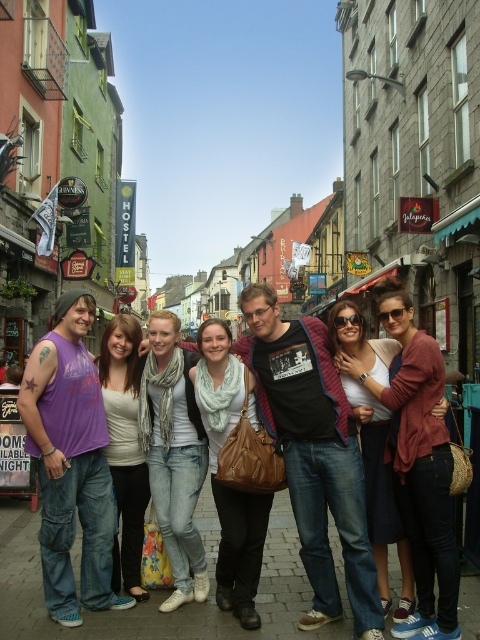
Who is shorter, light blue denim jeans at center or light blue scarf at center?

Standing shorter between the two is light blue scarf at center.

Between light blue denim jeans at center and light blue scarf at center, which one appears on the right side from the viewer's perspective?

light blue scarf at center is more to the right.

The image size is (480, 640). What are the coordinates of `light blue denim jeans at center` in the screenshot? It's located at pos(173,452).

Is denim skirt at center in front of light beige scarf at center?

Yes, denim skirt at center is closer to the viewer.

Can you confirm if denim skirt at center is positioned above light beige scarf at center?

Yes, denim skirt at center is above light beige scarf at center.

Find the location of a particular element. The image size is (480, 640). denim skirt at center is located at coordinates [381, 496].

This screenshot has width=480, height=640. I want to click on denim skirt at center, so click(381, 496).

Who is lower down, light blue denim jeans at center or light beige scarf at center?

Positioned lower is light beige scarf at center.

The width and height of the screenshot is (480, 640). What do you see at coordinates (173, 452) in the screenshot?
I see `light blue denim jeans at center` at bounding box center [173, 452].

You are a GUI agent. You are given a task and a screenshot of the screen. Output one action in this format:
    pyautogui.click(x=<x>, y=<y>)
    Task: Click on the light blue denim jeans at center
    
    Given the screenshot: What is the action you would take?
    pyautogui.click(x=173, y=452)